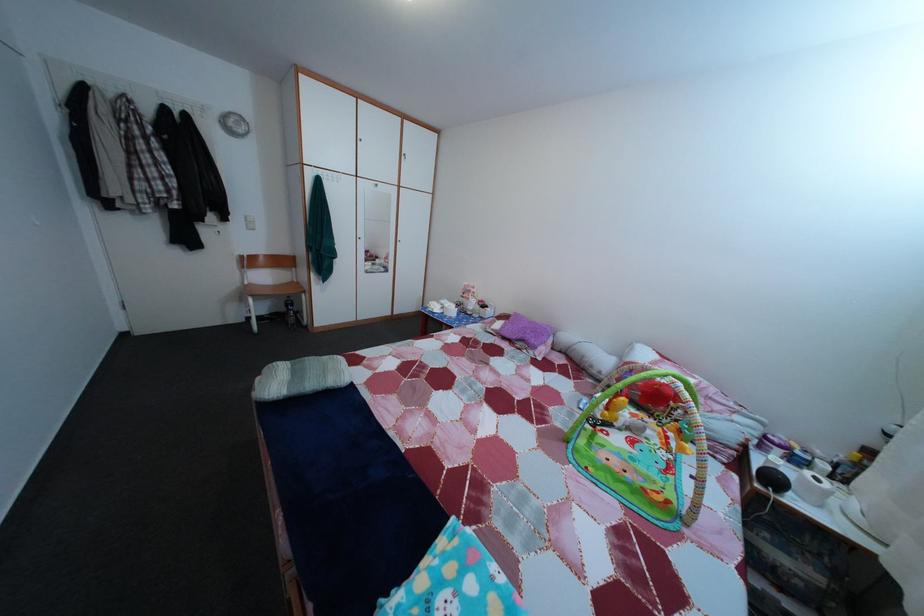
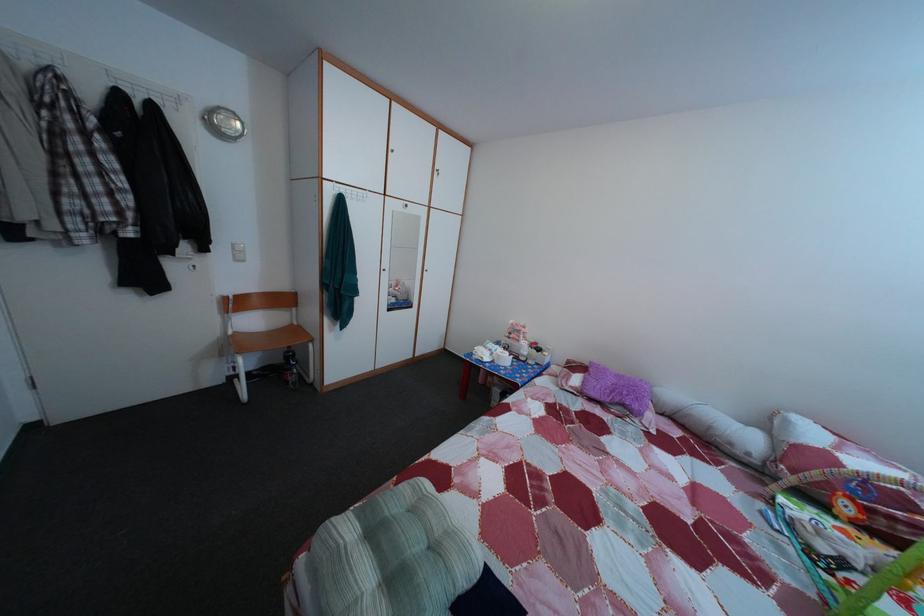
Which direction would the cameraman need to move to produce the second image?

The movement direction of the cameraman is left, forward.